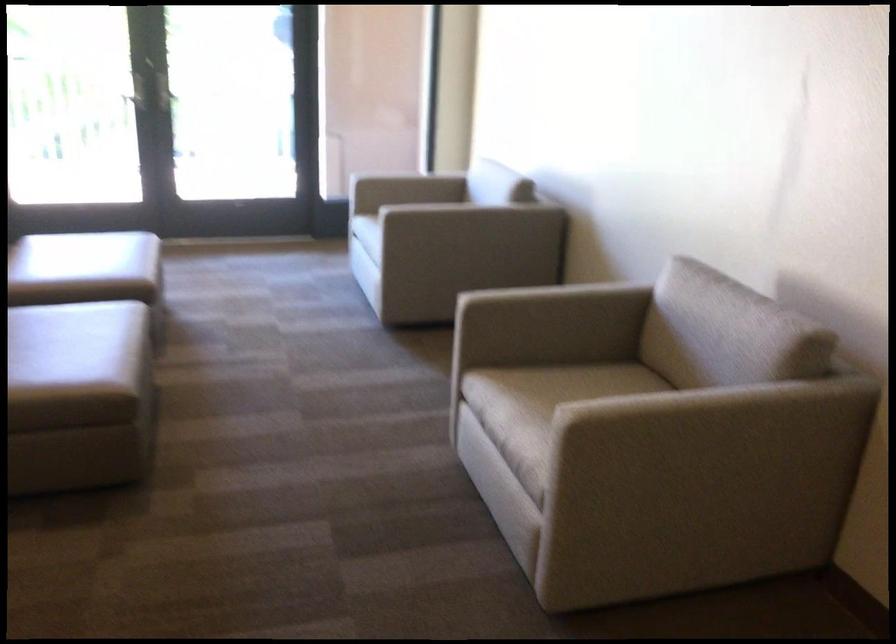
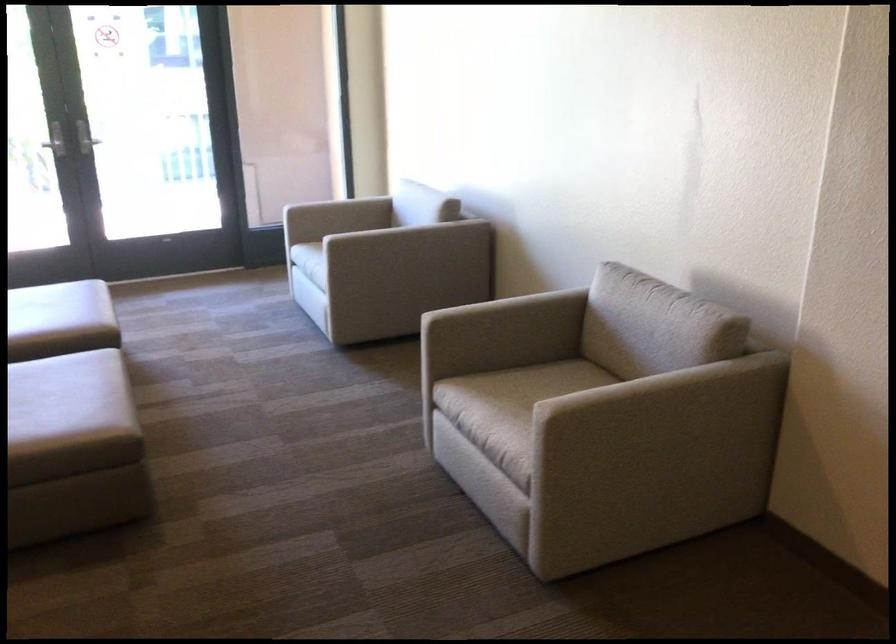
In the second image, find the point that corresponds to pixel 81 330 in the first image.

(65, 384)